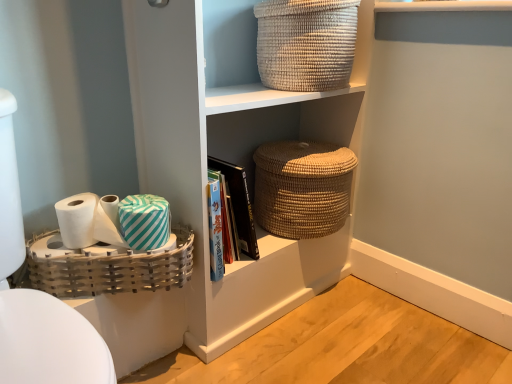
Question: Would you say hardcover book at center is outside white glossy toilet bowl at left?

Choices:
 (A) no
 (B) yes

Answer: (B)

Question: From the image's perspective, is hardcover book at center below white glossy toilet bowl at left?

Choices:
 (A) no
 (B) yes

Answer: (A)

Question: From the image's perspective, is hardcover book at center on white glossy toilet bowl at left?

Choices:
 (A) no
 (B) yes

Answer: (B)

Question: Can you confirm if hardcover book at center is positioned to the right of white glossy toilet bowl at left?

Choices:
 (A) no
 (B) yes

Answer: (B)

Question: Considering the relative sizes of hardcover book at center and white glossy toilet bowl at left in the image provided, is hardcover book at center thinner than white glossy toilet bowl at left?

Choices:
 (A) yes
 (B) no

Answer: (A)

Question: Does hardcover book at center have a larger size compared to white glossy toilet bowl at left?

Choices:
 (A) no
 (B) yes

Answer: (A)

Question: Is teal striped fabric at lower left next to woven bamboo basket at lower left, which is counted as the 3th basket, starting from the top, and touching it?

Choices:
 (A) yes
 (B) no

Answer: (B)

Question: From a real-world perspective, is teal striped fabric at lower left beneath woven bamboo basket at lower left, which is the 1th basket from bottom to top?

Choices:
 (A) yes
 (B) no

Answer: (B)

Question: Is woven bamboo basket at lower left, which is counted as the 3th basket, starting from the top, inside teal striped fabric at lower left?

Choices:
 (A) no
 (B) yes

Answer: (A)

Question: Does teal striped fabric at lower left lie behind woven bamboo basket at lower left, which is the 1th basket from bottom to top?

Choices:
 (A) no
 (B) yes

Answer: (B)

Question: Does teal striped fabric at lower left have a greater height compared to woven bamboo basket at lower left, which is counted as the 3th basket, starting from the top?

Choices:
 (A) no
 (B) yes

Answer: (A)

Question: From the image's perspective, is teal striped fabric at lower left above woven bamboo basket at lower left, which is counted as the 3th basket, starting from the top?

Choices:
 (A) yes
 (B) no

Answer: (A)

Question: Can you confirm if natural woven basket at center, the 2th basket viewed from the top, is bigger than white matte toilet paper at lower left, the 1th toilet paper positioned from the left?

Choices:
 (A) yes
 (B) no

Answer: (A)